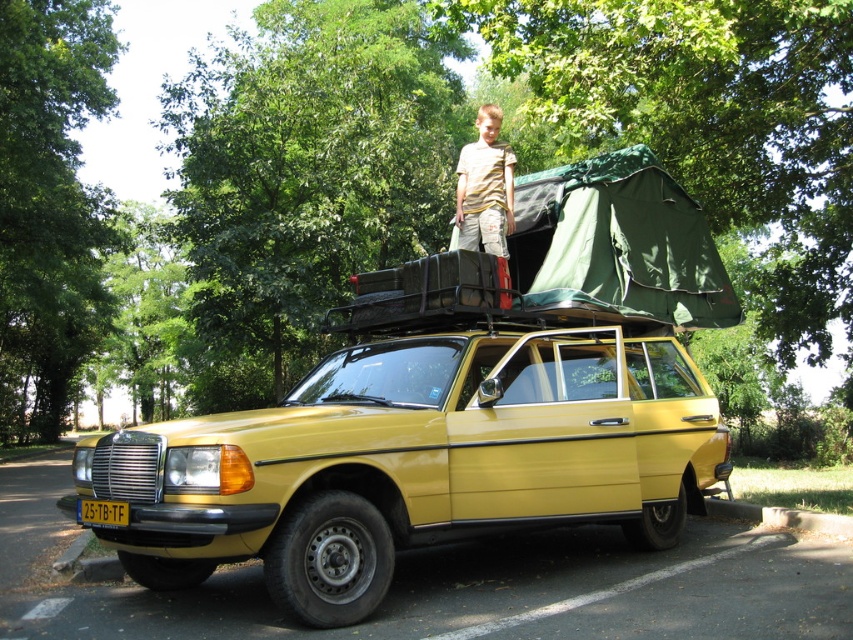
Identify the location of yellow matte car at center. This screenshot has height=640, width=853. (412, 461).

The image size is (853, 640). What do you see at coordinates (412, 461) in the screenshot?
I see `yellow matte car at center` at bounding box center [412, 461].

You are a GUI agent. You are given a task and a screenshot of the screen. Output one action in this format:
    pyautogui.click(x=<x>, y=<y>)
    Task: Click on the yellow matte car at center
    The width and height of the screenshot is (853, 640).
    Given the screenshot: What is the action you would take?
    pyautogui.click(x=412, y=461)

Does yellow striped shirt at upper center have a lesser height compared to yellow plastic license plate at lower left?

No.

Is point (479, 124) closer to camera compared to point (94, 499)?

No, (479, 124) is further to viewer.

Where is `yellow striped shirt at upper center`? Image resolution: width=853 pixels, height=640 pixels. yellow striped shirt at upper center is located at coordinates (485, 188).

Is yellow matte car at center positioned before yellow plastic license plate at lower left?

Yes, it is.

Which is behind, point (154, 588) or point (94, 520)?

Positioned behind is point (154, 588).

Locate an element on the screen. The height and width of the screenshot is (640, 853). yellow matte car at center is located at coordinates (412, 461).